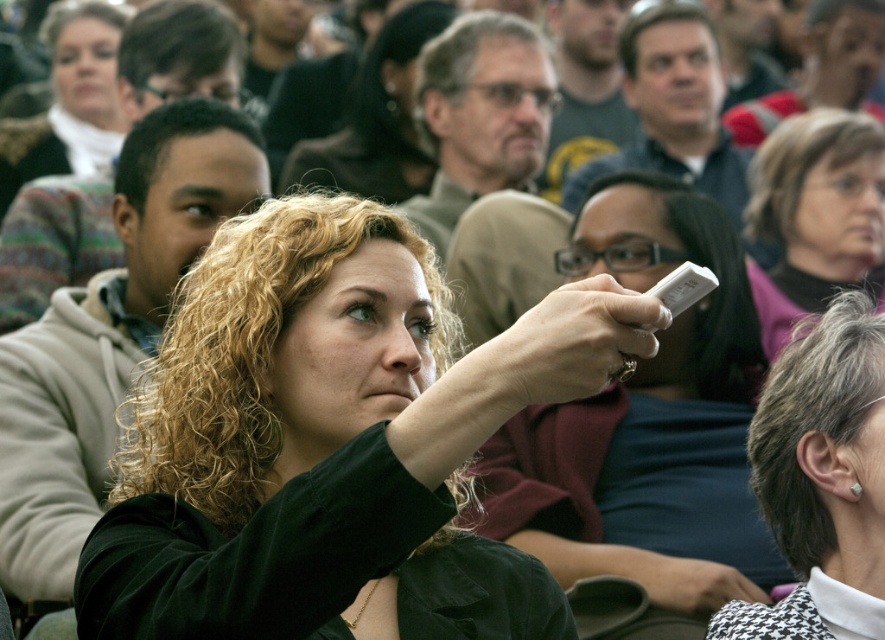
Can you confirm if black fabric shirt at center is positioned to the left of blonde curly hair at center?

Indeed, black fabric shirt at center is positioned on the left side of blonde curly hair at center.

Is the position of black fabric shirt at center more distant than that of blonde curly hair at center?

No.

Is point (88, 618) farther from camera compared to point (389, 196)?

That is False.

The width and height of the screenshot is (885, 640). I want to click on black fabric shirt at center, so click(329, 440).

Is matte black phone at center in front of white houndstooth blazer at lower right?

Yes, it is in front of white houndstooth blazer at lower right.

Does matte black phone at center have a larger size compared to white houndstooth blazer at lower right?

Indeed, matte black phone at center has a larger size compared to white houndstooth blazer at lower right.

Which is behind, point (537, 237) or point (853, 614)?

The point (537, 237) is more distant.

The image size is (885, 640). In order to click on matte black phone at center in this screenshot , I will do `click(626, 397)`.

Does white houndstooth blazer at lower right have a greater width compared to matte gray sweater at center?

In fact, white houndstooth blazer at lower right might be narrower than matte gray sweater at center.

From the picture: Is white houndstooth blazer at lower right further to camera compared to matte gray sweater at center?

No, white houndstooth blazer at lower right is in front of matte gray sweater at center.

Identify the location of white houndstooth blazer at lower right. (821, 481).

Identify the location of white houndstooth blazer at lower right. (821, 481).